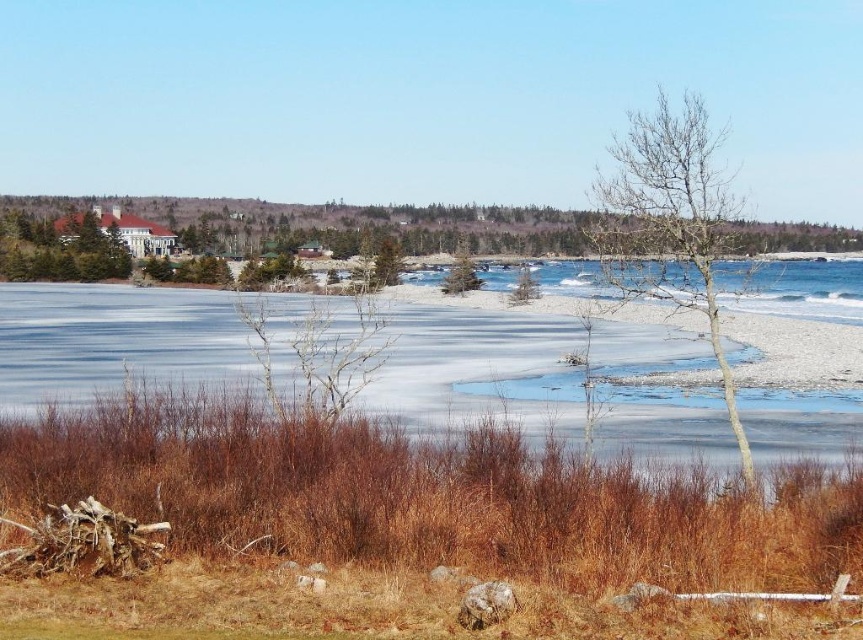
Question: Does bare wood tree at center come in front of green textured pine tree at center?

Choices:
 (A) yes
 (B) no

Answer: (A)

Question: Estimate the real-world distances between objects in this image. Which object is farther from the green matte tree at center?

Choices:
 (A) frozen ice at center
 (B) green textured pine tree at center
 (C) bare wood tree at center

Answer: (C)

Question: Is the position of frozen ice at center less distant than that of green matte tree at center?

Choices:
 (A) no
 (B) yes

Answer: (B)

Question: Which point is farther to the camera?

Choices:
 (A) (232, 371)
 (B) (523, 292)

Answer: (B)

Question: Which point appears closest to the camera in this image?

Choices:
 (A) (464, 244)
 (B) (669, 177)
 (C) (805, 410)

Answer: (B)

Question: Does green textured pine tree at center appear on the left side of green matte tree at center?

Choices:
 (A) no
 (B) yes

Answer: (B)